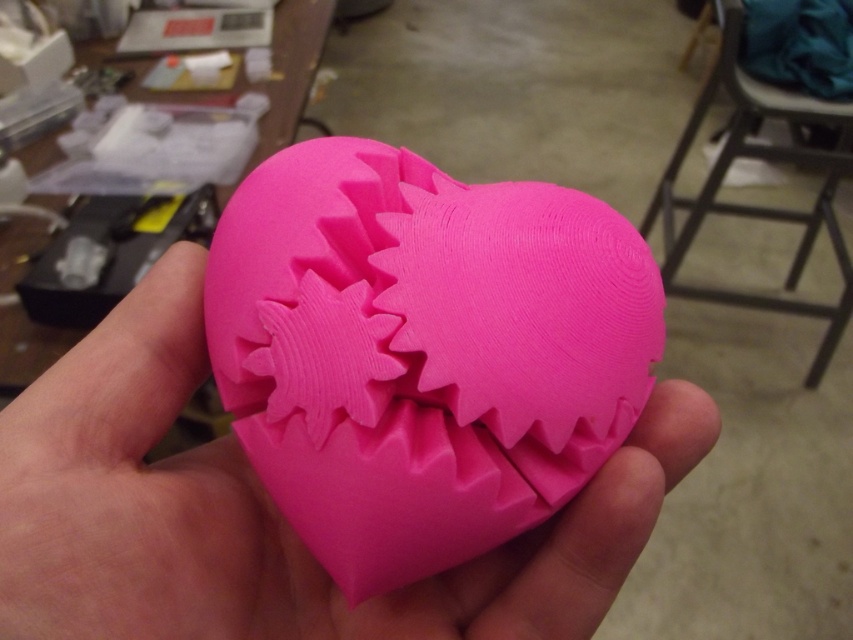
Question: Which point is closer to the camera?

Choices:
 (A) pink matte heart at center
 (B) metallic gray stool at upper right

Answer: (A)

Question: Observing the image, what is the correct spatial positioning of pink matte heart at center in reference to metallic gray stool at upper right?

Choices:
 (A) above
 (B) below

Answer: (B)

Question: Can you confirm if pink matte heart at center is positioned above metallic gray stool at upper right?

Choices:
 (A) yes
 (B) no

Answer: (B)

Question: Can you confirm if pink matte heart at center is positioned to the right of metallic gray stool at upper right?

Choices:
 (A) no
 (B) yes

Answer: (A)

Question: Among these points, which one is farthest from the camera?

Choices:
 (A) (762, 154)
 (B) (120, 595)

Answer: (A)